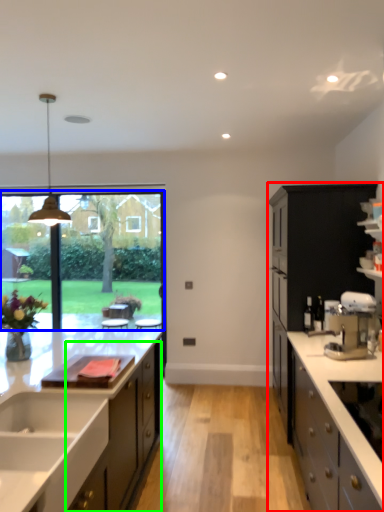
Question: Which is farther away from cabinetry (highlighted by a red box)? window screen (highlighted by a blue box) or cabinetry (highlighted by a green box)?

Choices:
 (A) window screen
 (B) cabinetry

Answer: (A)